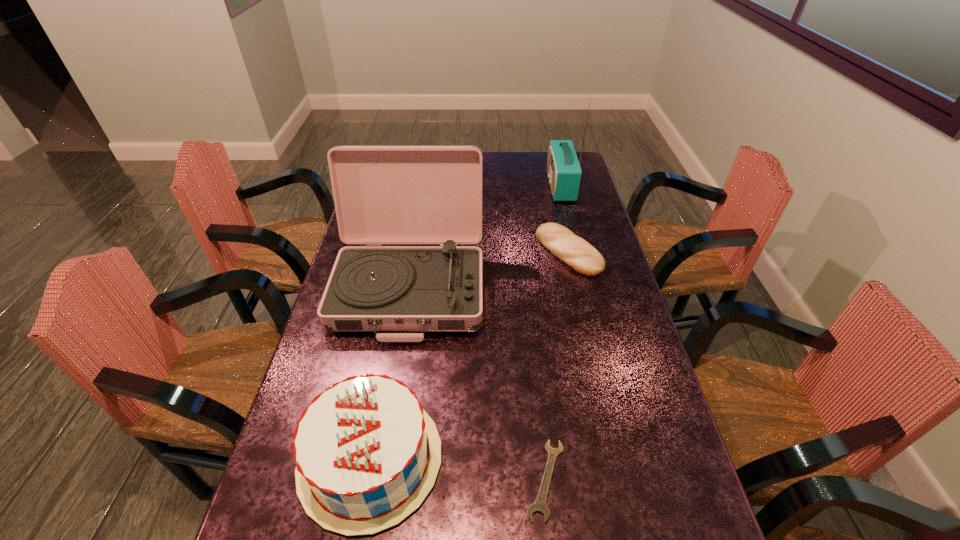
Find the location of a particular element. This screenshot has height=540, width=960. vacant space located 0.060m on the right of the third tallest object is located at coordinates (468, 459).

Identify the location of free spot located 0.290m on the back of the bread. point(554,187).

You are a GUI agent. You are given a task and a screenshot of the screen. Output one action in this format:
    pyautogui.click(x=<x>, y=<y>)
    Task: Click on the free space located on the left of the third object from right to left
    
    Given the screenshot: What is the action you would take?
    pyautogui.click(x=426, y=480)

You are a GUI agent. You are given a task and a screenshot of the screen. Output one action in this format:
    pyautogui.click(x=<x>, y=<y>)
    Task: Click on the object that is at the far edge
    
    Given the screenshot: What is the action you would take?
    pyautogui.click(x=564, y=172)

Locate an element on the screen. The image size is (960, 540). record player that is positioned at the left edge is located at coordinates (382, 194).

Find the location of a particular element. The height and width of the screenshot is (540, 960). birthday cake that is at the left edge is located at coordinates click(x=367, y=454).

Locate an element on the screen. radio receiver present at the right edge is located at coordinates (564, 172).

The height and width of the screenshot is (540, 960). Find the location of `bread that is positioned at the right edge`. bread that is positioned at the right edge is located at coordinates (573, 250).

Find the location of a particular element. object at the far right corner is located at coordinates (564, 172).

In the image, there is a desktop. In order to click on vacant space at the far edge in this screenshot , I will do `click(513, 179)`.